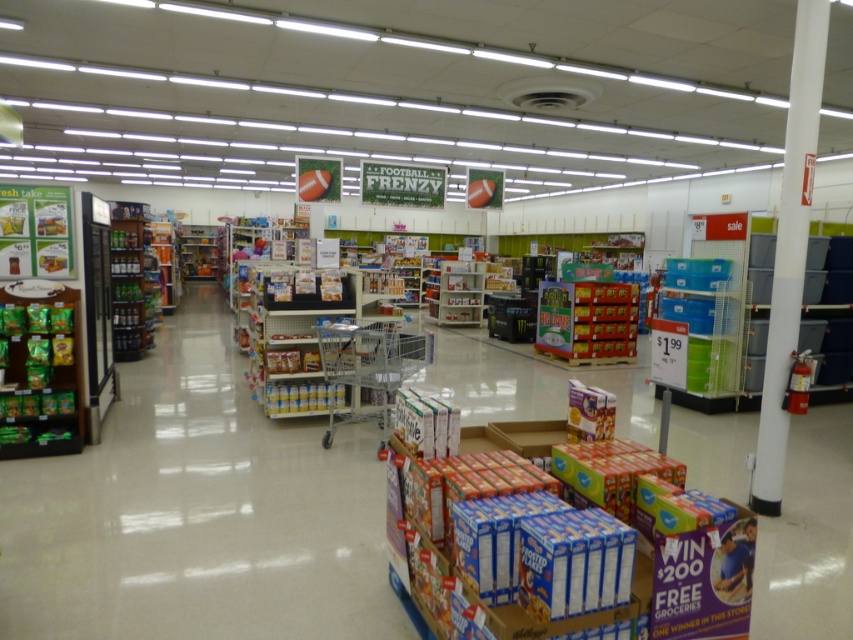
Question: Which of the following is the closest to the observer?

Choices:
 (A) metallic silver beverage at left
 (B) green matte snack at left

Answer: (B)

Question: Which of the following is the closest to the observer?

Choices:
 (A) metallic silver shopping cart at center
 (B) metallic silver beverage at left

Answer: (A)

Question: From the image, what is the correct spatial relationship of green matte snack at left in relation to matte cardboard cereal boxes at center?

Choices:
 (A) right
 (B) left

Answer: (B)

Question: Can you confirm if green matte snack at left is smaller than matte cardboard cereal boxes at center?

Choices:
 (A) no
 (B) yes

Answer: (B)

Question: Which of these objects is positioned farthest from the metallic silver beverage at left?

Choices:
 (A) metallic silver shopping cart at center
 (B) matte cardboard cereal boxes at center
 (C) green matte snack at left

Answer: (B)

Question: Is green matte snack at left closer to the viewer compared to metallic silver beverage at left?

Choices:
 (A) yes
 (B) no

Answer: (A)